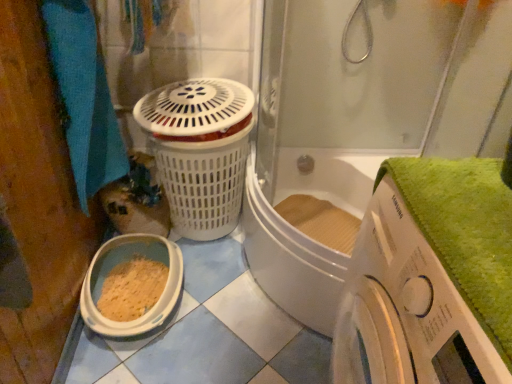
Question: Is blue fabric towel at left with white plastic washing machine at lower right?

Choices:
 (A) no
 (B) yes

Answer: (A)

Question: From the image's perspective, is blue fabric towel at left located beneath white plastic washing machine at lower right?

Choices:
 (A) yes
 (B) no

Answer: (B)

Question: From the image's perspective, is blue fabric towel at left over white plastic washing machine at lower right?

Choices:
 (A) no
 (B) yes

Answer: (B)

Question: From a real-world perspective, is blue fabric towel at left on white plastic washing machine at lower right?

Choices:
 (A) yes
 (B) no

Answer: (A)

Question: Can white plastic washing machine at lower right be found inside blue fabric towel at left?

Choices:
 (A) no
 (B) yes

Answer: (A)

Question: Looking at their shapes, would you say white plastic washing machine at lower right is wider or thinner than blue fabric towel at left?

Choices:
 (A) wide
 (B) thin

Answer: (A)

Question: From the image's perspective, is white plastic washing machine at lower right positioned above or below blue fabric towel at left?

Choices:
 (A) above
 (B) below

Answer: (B)

Question: Based on their sizes in the image, would you say white plastic washing machine at lower right is bigger or smaller than blue fabric towel at left?

Choices:
 (A) big
 (B) small

Answer: (A)

Question: Would you say white plastic washing machine at lower right is inside or outside blue fabric towel at left?

Choices:
 (A) inside
 (B) outside

Answer: (B)

Question: Relative to white plastic washing machine at lower right, is blue fabric towel at left in front or behind?

Choices:
 (A) behind
 (B) front

Answer: (A)

Question: Based on their sizes in the image, would you say blue fabric towel at left is bigger or smaller than white plastic washing machine at lower right?

Choices:
 (A) small
 (B) big

Answer: (A)

Question: From the image's perspective, is blue fabric towel at left positioned above or below white plastic washing machine at lower right?

Choices:
 (A) above
 (B) below

Answer: (A)

Question: From a real-world perspective, is blue fabric towel at left above or below white plastic washing machine at lower right?

Choices:
 (A) below
 (B) above

Answer: (B)

Question: Is white plastic washing machine at lower right inside or outside of transparent glass shower door at upper center?

Choices:
 (A) outside
 (B) inside

Answer: (A)

Question: In the image, is white plastic washing machine at lower right positioned in front of or behind transparent glass shower door at upper center?

Choices:
 (A) front
 (B) behind

Answer: (A)